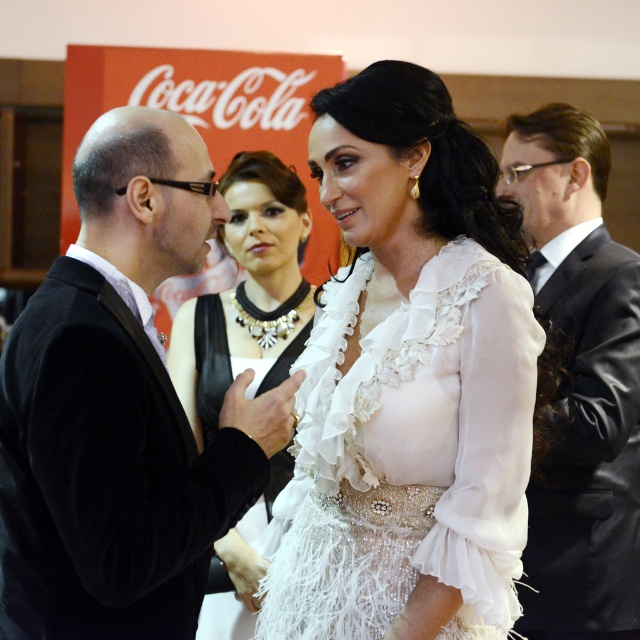
Question: Which point is closer to the camera?

Choices:
 (A) white sheer dress at center
 (B) velvet black suit at left
 (C) black satin suit at right
 (D) white lace dress at center

Answer: (B)

Question: Does velvet black suit at left have a greater width compared to white sheer dress at center?

Choices:
 (A) no
 (B) yes

Answer: (A)

Question: Is the position of white sheer dress at center more distant than that of white lace dress at center?

Choices:
 (A) no
 (B) yes

Answer: (A)

Question: Among these points, which one is farthest from the camera?

Choices:
 (A) (285, 346)
 (B) (547, 557)

Answer: (A)

Question: Does white sheer dress at center appear over black satin suit at right?

Choices:
 (A) yes
 (B) no

Answer: (B)

Question: Which of these objects is positioned farthest from the white lace dress at center?

Choices:
 (A) velvet black suit at left
 (B) white sheer dress at center
 (C) black satin suit at right

Answer: (A)